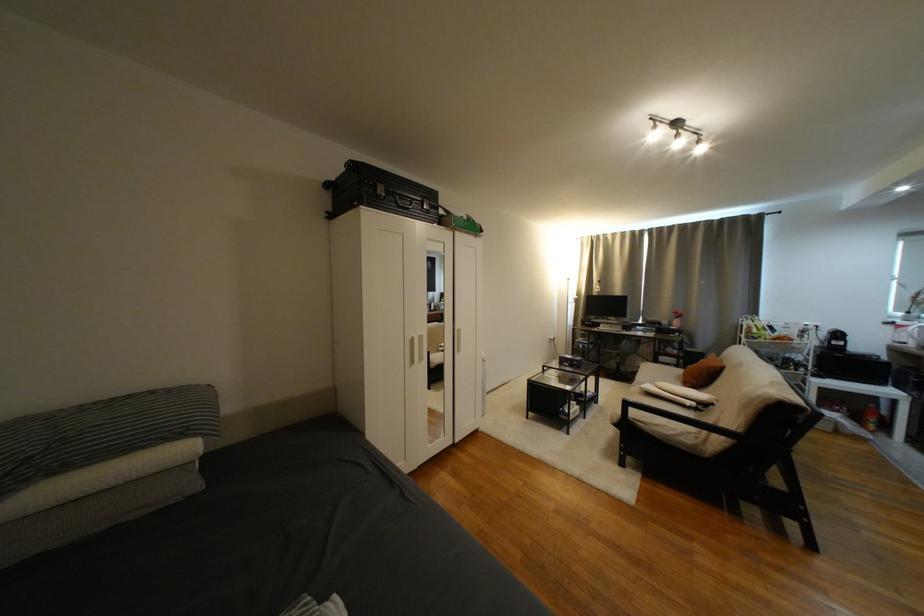
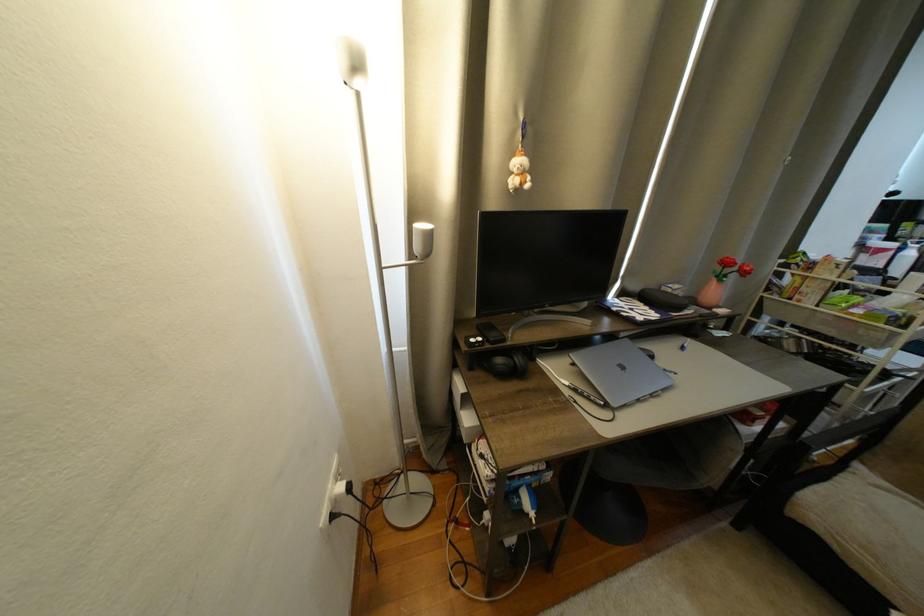
Where in the second image is the point corresponding to point 562,339 from the first image?

(358, 490)